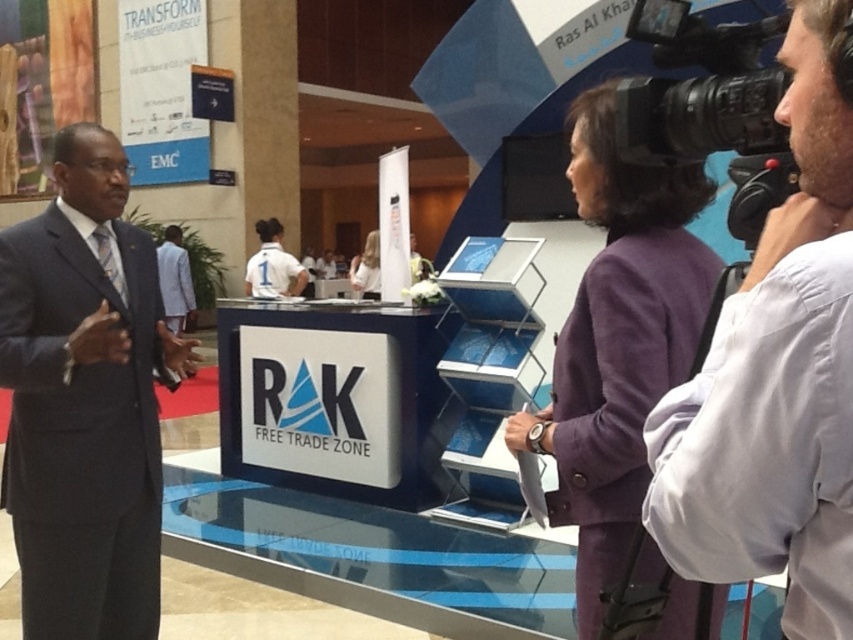
Is white shirt at center positioned behind white jersey at center?

No.

Is white shirt at center taller than white jersey at center?

No.

Where is `white shirt at center`? This screenshot has width=853, height=640. white shirt at center is located at coordinates (776, 376).

Looking at this image, is white shirt at center thinner than dark blue suit at left?

Yes, white shirt at center is thinner than dark blue suit at left.

Which is behind, point (683, 547) or point (15, 541)?

Positioned behind is point (15, 541).

Where is `white shirt at center`? The image size is (853, 640). white shirt at center is located at coordinates (776, 376).

Which of these two, dark blue suit at left or black plastic video camera at upper right, stands shorter?

black plastic video camera at upper right is shorter.

Does dark blue suit at left appear over black plastic video camera at upper right?

No.

At what (x,y) coordinates should I click in order to perform the action: click on dark blue suit at left. Please return your answer as a coordinate pair (x, y). Looking at the image, I should click on (85, 401).